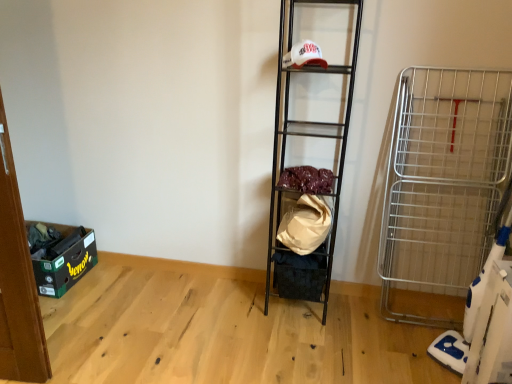
The image size is (512, 384). In order to click on free point behind silver metallic cart at right in this screenshot , I will do `click(425, 317)`.